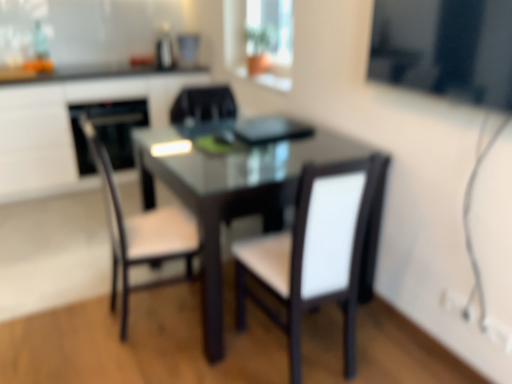
Image resolution: width=512 pixels, height=384 pixels. I want to click on free space that is to the left of white matte chair at center, which is counted as the third chair, starting from the right, so click(x=73, y=310).